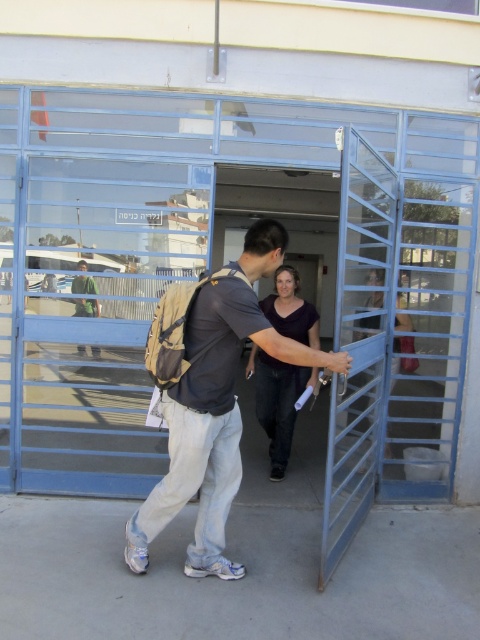
Question: Where is blue metallic gate at center located in relation to green fabric shirt at center in the image?

Choices:
 (A) right
 (B) left

Answer: (B)

Question: Estimate the real-world distances between objects in this image. Which object is closer to the khaki fabric backpack at center?

Choices:
 (A) green fabric shirt at center
 (B) blue metallic gate at center
 (C) dark purple shirt at center

Answer: (C)

Question: Among these points, which one is nearest to the camera?

Choices:
 (A) (282, 384)
 (B) (92, 307)
 (C) (22, 244)
 (D) (336, 362)

Answer: (D)

Question: Which is nearer to the dark purple shirt at center?

Choices:
 (A) blue metallic gate at center
 (B) green fabric shirt at center
 (C) transparent glass door at center

Answer: (C)

Question: Is transparent glass door at center bigger than dark purple shirt at center?

Choices:
 (A) yes
 (B) no

Answer: (A)

Question: Is transparent glass door at center wider than dark purple shirt at center?

Choices:
 (A) yes
 (B) no

Answer: (A)